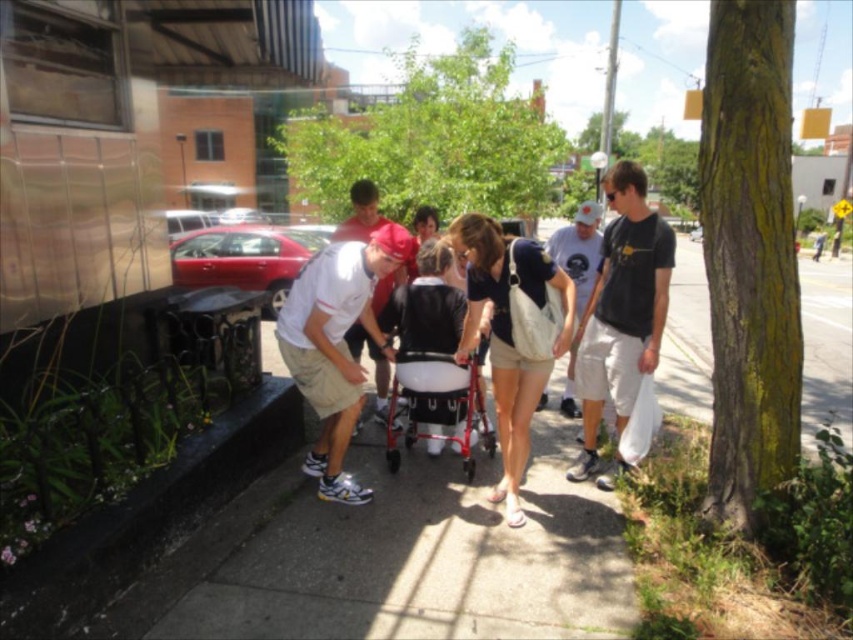
Question: Can you confirm if white matte shirt at center is positioned below beige canvas bag at center?

Choices:
 (A) no
 (B) yes

Answer: (A)

Question: Which object is positioned closest to the matte red cap at center?

Choices:
 (A) white plastic walker at center
 (B) light blue jeans at center
 (C) matte black t-shirt at center

Answer: (A)

Question: Is matte black t-shirt at right positioned at the back of matte red cap at center?

Choices:
 (A) no
 (B) yes

Answer: (A)

Question: Which object is farther from the camera taking this photo?

Choices:
 (A) metallic red car at left
 (B) beige canvas bag at center

Answer: (A)

Question: From the image, what is the correct spatial relationship of green leafy tree at center in relation to matte black t-shirt at center?

Choices:
 (A) right
 (B) left

Answer: (B)

Question: Which object is positioned closest to the black concrete curb at lower left?

Choices:
 (A) light blue jeans at center
 (B) matte black t-shirt at center
 (C) beige canvas bag at center

Answer: (C)